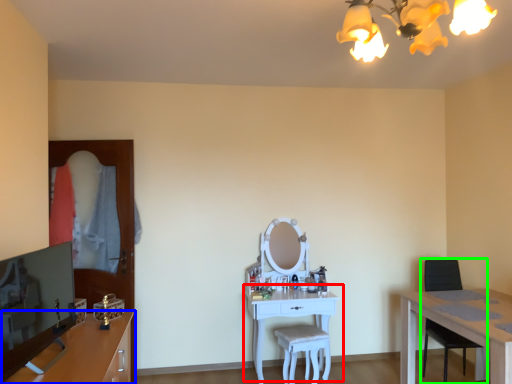
Question: Estimate the real-world distances between objects in this image. Which object is closer to table (highlighted by a red box), cabinetry (highlighted by a blue box) or chair (highlighted by a green box)?

Choices:
 (A) cabinetry
 (B) chair

Answer: (B)